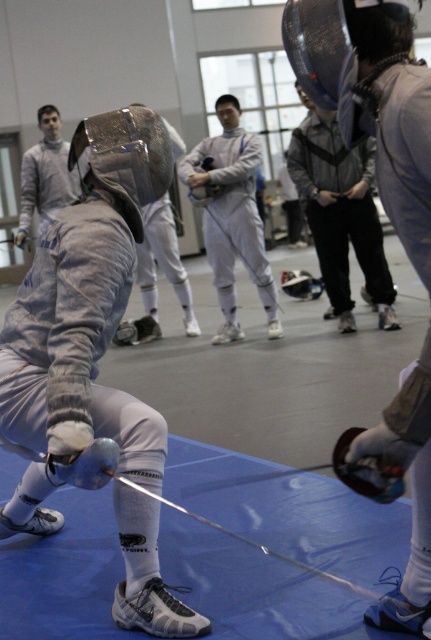
Question: Does gray fabric jacket at center have a larger size compared to matte gray fencing uniform at center?

Choices:
 (A) yes
 (B) no

Answer: (A)

Question: Estimate the real-world distances between objects in this image. Which object is closer to the matte silver fencing mask at upper left?

Choices:
 (A) matte gray fencing uniform at center
 (B) gray fabric jacket at center

Answer: (A)

Question: Is gray fabric jacket at center positioned in front of matte gray fencing uniform at center?

Choices:
 (A) no
 (B) yes

Answer: (B)

Question: Which of the following is the farthest from the observer?

Choices:
 (A) (172, 276)
 (B) (63, 195)
 (C) (233, 180)

Answer: (A)

Question: Which of the following is the closest to the observer?

Choices:
 (A) matte silver fencing mask at upper left
 (B) gray fabric jacket at center

Answer: (B)

Question: Does gray fabric jacket at center appear on the left side of matte silver fencing mask at upper left?

Choices:
 (A) yes
 (B) no

Answer: (B)